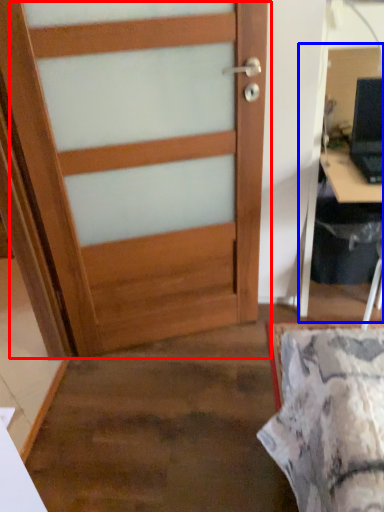
Question: Which object appears closest to the camera in this image, door (highlighted by a red box) or computer desk (highlighted by a blue box)?

Choices:
 (A) door
 (B) computer desk

Answer: (B)